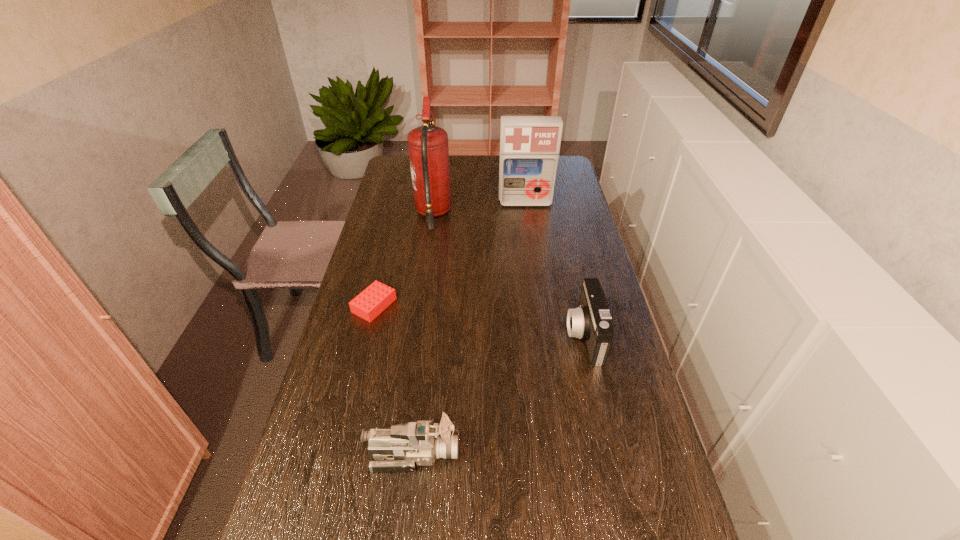
At what (x,y) coordinates should I click in order to perform the action: click on the tallest object. Please return your answer as a coordinate pair (x, y). This screenshot has width=960, height=540. Looking at the image, I should click on (428, 145).

At what (x,y) coordinates should I click in order to perform the action: click on the first-aid kit. Please return your answer as a coordinate pair (x, y). The width and height of the screenshot is (960, 540). Looking at the image, I should click on (529, 145).

Identify the location of the farther camcorder. (591, 320).

Image resolution: width=960 pixels, height=540 pixels. Identify the location of the nearest object. (399, 449).

Locate an element on the screen. The height and width of the screenshot is (540, 960). the left camcorder is located at coordinates (399, 449).

Identify the location of Lego. (373, 300).

The image size is (960, 540). What are the coordinates of `the leftmost object` in the screenshot? It's located at (373, 300).

This screenshot has height=540, width=960. In order to click on free location located at the front of the fire extinguisher where the nozzle is aimed in this screenshot , I will do `click(511, 214)`.

Find the location of a particular element. vacant space situated 0.080m on the front-facing side of the first-aid kit is located at coordinates (528, 219).

Where is `free location located on the lens of the right camcorder`? free location located on the lens of the right camcorder is located at coordinates (465, 335).